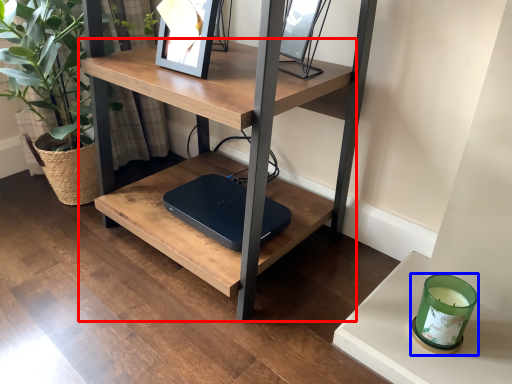
Question: Which point is closer to the camera, table (highlighted by a red box) or candle holder (highlighted by a blue box)?

Choices:
 (A) table
 (B) candle holder

Answer: (A)